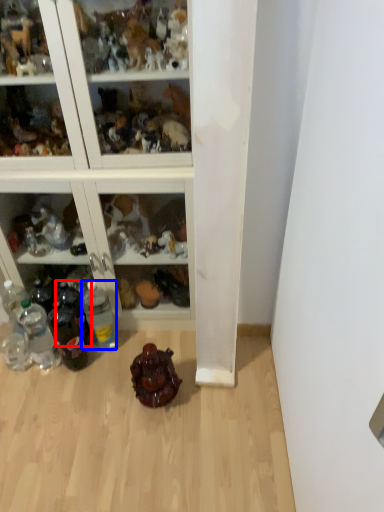
Question: Which of the following is the farthest to the observer, bottle (highlighted by a red box) or bottle (highlighted by a blue box)?

Choices:
 (A) bottle
 (B) bottle

Answer: (A)